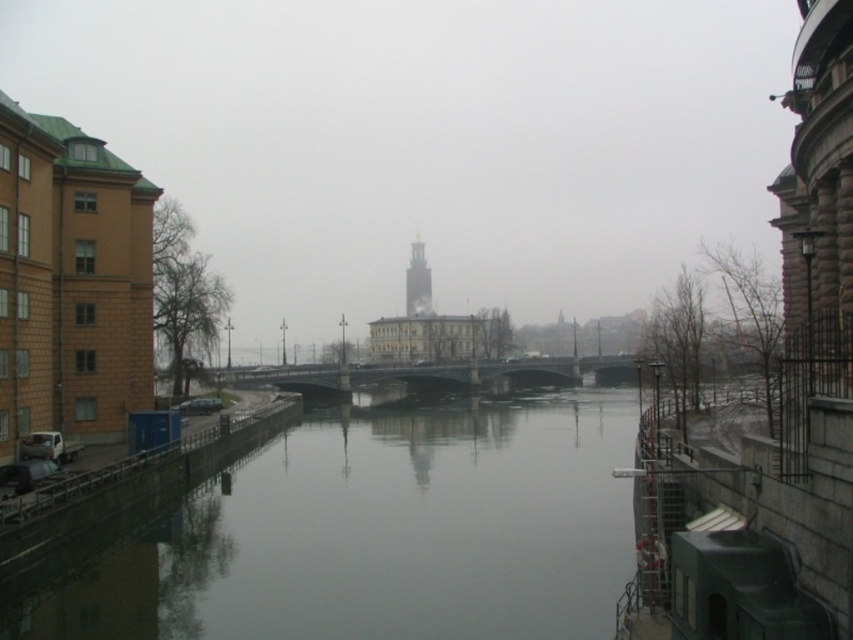
Is dark gray concrete bridge at center further to the viewer compared to gold textured tower at center?

No.

Does dark gray concrete bridge at center appear over gold textured tower at center?

Actually, dark gray concrete bridge at center is below gold textured tower at center.

Where is `dark gray concrete bridge at center`? This screenshot has height=640, width=853. dark gray concrete bridge at center is located at coordinates (439, 374).

Looking at this image, between smooth concrete river at center and dark gray concrete bridge at center, which one appears on the left side from the viewer's perspective?

smooth concrete river at center is more to the left.

Between smooth concrete river at center and dark gray concrete bridge at center, which one has less height?

With less height is smooth concrete river at center.

At what (x,y) coordinates should I click in order to perform the action: click on smooth concrete river at center. Please return your answer as a coordinate pair (x, y). Looking at the image, I should click on point(379,532).

At what (x,y) coordinates should I click in order to perform the action: click on smooth concrete river at center. Please return your answer as a coordinate pair (x, y). Looking at the image, I should click on (379, 532).

Does smooth concrete river at center have a lesser height compared to gold textured tower at center?

Yes, smooth concrete river at center is shorter than gold textured tower at center.

Can you confirm if smooth concrete river at center is positioned below gold textured tower at center?

Yes, smooth concrete river at center is below gold textured tower at center.

Does point (439, 504) lie in front of point (422, 298)?

Yes, it is.

Locate an element on the screen. smooth concrete river at center is located at coordinates (379, 532).